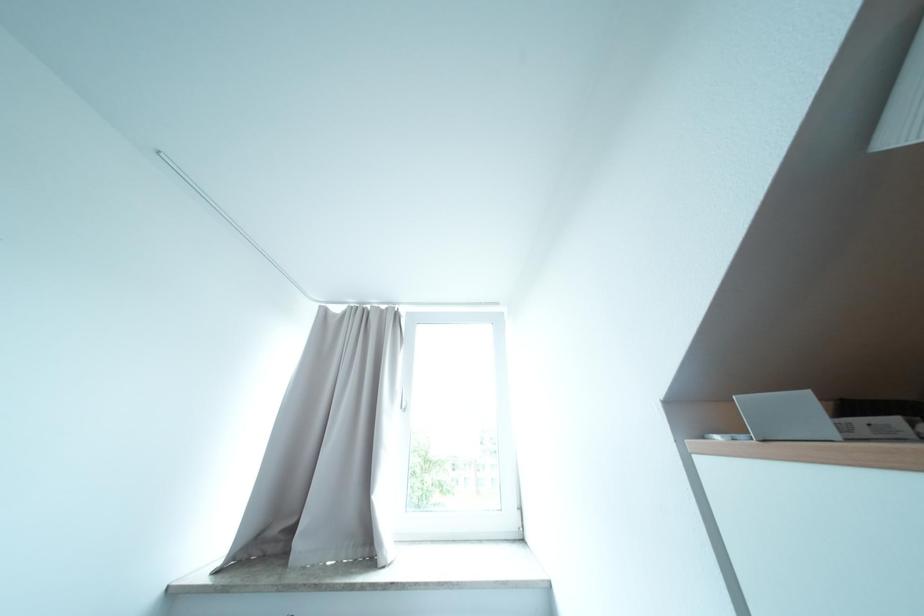
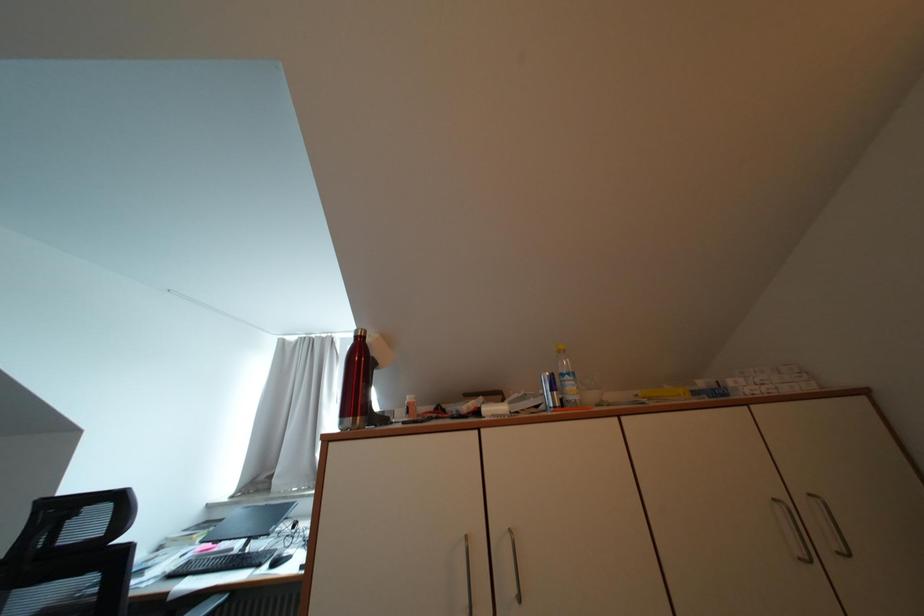
Which direction would the cameraman need to move to produce the second image?

The cameraman moved toward right, backward.